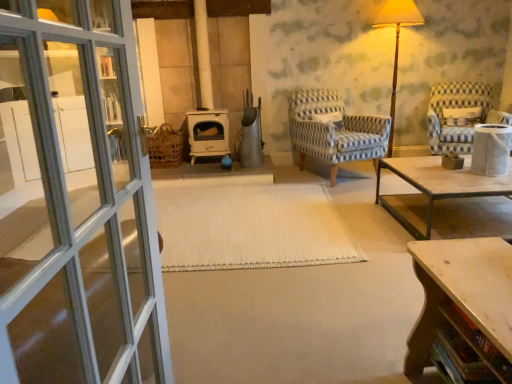
What do you see at coordinates (250, 227) in the screenshot? The height and width of the screenshot is (384, 512). I see `white textured mat at center` at bounding box center [250, 227].

Where is `wooden side table at right`? This screenshot has width=512, height=384. wooden side table at right is located at coordinates (490, 149).

At what (x,y) coordinates should I click in order to perform the action: click on white textured mat at center. Please return your answer as a coordinate pair (x, y). This screenshot has width=512, height=384. Looking at the image, I should click on (250, 227).

How distant is white textured mat at center from blue-patterned fabric chair at center, the 1th chair when ordered from left to right?

white textured mat at center is 3.74 feet away from blue-patterned fabric chair at center, the 1th chair when ordered from left to right.

Looking at their sizes, would you say white textured mat at center is wider or thinner than blue-patterned fabric chair at center, the 1th chair when ordered from left to right?

In the image, white textured mat at center appears to be wider than blue-patterned fabric chair at center, the 1th chair when ordered from left to right.

In order to click on the 1st chair behind the white textured mat at center, starting your count from the anchor in this screenshot , I will do `click(334, 131)`.

From the image's perspective, between white textured mat at center and blue-patterned fabric chair at center, placed as the second chair when sorted from right to left, which one is located above?

blue-patterned fabric chair at center, placed as the second chair when sorted from right to left, appears higher in the image.

Which is behind, wooden side table at right or wooden floor lamp at upper right?

wooden floor lamp at upper right is further from the camera.

Is wooden side table at right inside the boundaries of wooden floor lamp at upper right, or outside?

wooden side table at right exists outside the volume of wooden floor lamp at upper right.

Is point (501, 164) positioned in front of point (379, 20)?

Yes, point (501, 164) is in front of point (379, 20).

Is wooden side table at right positioned far away from wooden floor lamp at upper right?

Yes.

Looking at the image, does wooden floor lamp at upper right seem bigger or smaller compared to blue and white patterned fabric armchair at right, which is the second chair in left-to-right order?

Clearly, wooden floor lamp at upper right is smaller in size than blue and white patterned fabric armchair at right, which is the second chair in left-to-right order.

Consider the image. Does wooden floor lamp at upper right come behind blue and white patterned fabric armchair at right, which is counted as the first chair, starting from the right?

Yes, wooden floor lamp at upper right is behind blue and white patterned fabric armchair at right, which is counted as the first chair, starting from the right.

Can you confirm if wooden floor lamp at upper right is thinner than blue and white patterned fabric armchair at right, which is counted as the first chair, starting from the right?

Indeed, wooden floor lamp at upper right has a lesser width compared to blue and white patterned fabric armchair at right, which is counted as the first chair, starting from the right.

Considering the positions of points (417, 17) and (459, 85), is point (417, 17) closer to camera compared to point (459, 85)?

Yes, point (417, 17) is closer to viewer.

Is white textured mat at center touching blue and white patterned fabric armchair at right, which is the second chair in left-to-right order?

white textured mat at center and blue and white patterned fabric armchair at right, which is the second chair in left-to-right order, are not in contact.

From a real-world perspective, is white textured mat at center over blue and white patterned fabric armchair at right, which is the second chair in left-to-right order?

No, from a real-world perspective, white textured mat at center is not over blue and white patterned fabric armchair at right, which is the second chair in left-to-right order

From the image's perspective, between white textured mat at center and blue and white patterned fabric armchair at right, which is the second chair in left-to-right order, who is located below?

white textured mat at center, from the image's perspective.

Relative to blue and white patterned fabric armchair at right, which is counted as the first chair, starting from the right, is white textured mat at center in front or behind?

Clearly, white textured mat at center is in front of blue and white patterned fabric armchair at right, which is counted as the first chair, starting from the right.

Consider the image. Does wooden side table at right have a greater height compared to wooden table at lower right?

No, wooden side table at right is not taller than wooden table at lower right.

Does wooden side table at right have a lesser width compared to wooden table at lower right?

Correct, the width of wooden side table at right is less than that of wooden table at lower right.

At what (x,y) coordinates should I click in order to perform the action: click on table located in front of the wooden side table at right. Please return your answer as a coordinate pair (x, y). This screenshot has height=384, width=512. Looking at the image, I should click on (463, 309).

Could you tell me if wooden side table at right is turned towards wooden table at lower right?

No, wooden side table at right is not aimed at wooden table at lower right.

Is white textured mat at center surrounding wooden floor lamp at upper right?

No, white textured mat at center does not contain wooden floor lamp at upper right.

Considering the positions of point (219, 230) and point (412, 0), is point (219, 230) closer or farther from the camera than point (412, 0)?

Point (219, 230) is positioned closer to the camera compared to point (412, 0).

Who is shorter, white textured mat at center or wooden floor lamp at upper right?

white textured mat at center is shorter.

How many degrees apart are the facing directions of white textured mat at center and wooden floor lamp at upper right?

They differ by 89.3 degrees in their facing directions.

How different are the orientations of wooden table at lower right and wooden floor lamp at upper right in degrees?

wooden table at lower right and wooden floor lamp at upper right are facing 89.5 degrees away from each other.

From a real-world perspective, who is located lower, wooden table at lower right or wooden floor lamp at upper right?

In real-world perspective, wooden table at lower right is lower.

Does wooden table at lower right have a smaller size compared to wooden floor lamp at upper right?

Correct, wooden table at lower right occupies less space than wooden floor lamp at upper right.

Is wooden table at lower right far from wooden floor lamp at upper right?

Indeed, wooden table at lower right is not near wooden floor lamp at upper right.

You are a GUI agent. You are given a task and a screenshot of the screen. Output one action in this format:
    pyautogui.click(x=<x>, y=<y>)
    Task: Click on the mat in front of the blue-patterned fabric chair at center, placed as the second chair when sorted from right to left
    Image resolution: width=512 pixels, height=384 pixels.
    Given the screenshot: What is the action you would take?
    point(250,227)

Find the location of a particular element. This screenshot has width=512, height=384. table lamp on the left of wooden side table at right is located at coordinates (396, 42).

Looking at the image, which one is located further to blue-patterned fabric chair at center, placed as the second chair when sorted from right to left, wooden side table at right or white textured mat at center?

Based on the image, wooden side table at right appears to be further to blue-patterned fabric chair at center, placed as the second chair when sorted from right to left.

Considering their positions, is blue and white patterned fabric armchair at right, which is counted as the first chair, starting from the right, positioned further to wooden table at lower right than blue-patterned fabric chair at center, placed as the second chair when sorted from right to left?

Based on the image, blue-patterned fabric chair at center, placed as the second chair when sorted from right to left, appears to be further to wooden table at lower right.

Based on their spatial positions, is wooden floor lamp at upper right or wooden side table at right further from blue-patterned fabric chair at center, the 1th chair when ordered from left to right?

wooden side table at right is positioned further to the anchor blue-patterned fabric chair at center, the 1th chair when ordered from left to right.

Considering their positions, is blue-patterned fabric chair at center, placed as the second chair when sorted from right to left, positioned further to wooden table at lower right than blue and white patterned fabric armchair at right, which is counted as the first chair, starting from the right?

The object further to wooden table at lower right is blue-patterned fabric chair at center, placed as the second chair when sorted from right to left.

Which object lies further to the anchor point blue-patterned fabric chair at center, placed as the second chair when sorted from right to left, wooden table at lower right or wooden side table at right?

Among the two, wooden table at lower right is located further to blue-patterned fabric chair at center, placed as the second chair when sorted from right to left.

In the scene shown: From the image, which object appears to be farther from blue and white patterned fabric armchair at right, which is the second chair in left-to-right order, wooden table at lower right or blue-patterned fabric chair at center, placed as the second chair when sorted from right to left?

Based on the image, wooden table at lower right appears to be further to blue and white patterned fabric armchair at right, which is the second chair in left-to-right order.

From the picture: Based on their spatial positions, is white textured mat at center or blue and white patterned fabric armchair at right, which is the second chair in left-to-right order, further from wooden floor lamp at upper right?

white textured mat at center.

Based on their spatial positions, is blue-patterned fabric chair at center, the 1th chair when ordered from left to right, or blue and white patterned fabric armchair at right, which is counted as the first chair, starting from the right, further from wooden floor lamp at upper right?

blue-patterned fabric chair at center, the 1th chair when ordered from left to right, lies further to wooden floor lamp at upper right than the other object.

Image resolution: width=512 pixels, height=384 pixels. What are the coordinates of `side table positioned between wooden table at lower right and blue-patterned fabric chair at center, the 1th chair when ordered from left to right, from near to far` in the screenshot? It's located at (490, 149).

The height and width of the screenshot is (384, 512). What are the coordinates of `chair between white textured mat at center and wooden floor lamp at upper right` in the screenshot? It's located at 334,131.

Find the location of `side table between wooden table at lower right and blue and white patterned fabric armchair at right, which is counted as the first chair, starting from the right, from front to back`. side table between wooden table at lower right and blue and white patterned fabric armchair at right, which is counted as the first chair, starting from the right, from front to back is located at coordinates (490, 149).

Where is `chair between wooden table at lower right and blue and white patterned fabric armchair at right, which is counted as the first chair, starting from the right, along the z-axis`? This screenshot has width=512, height=384. chair between wooden table at lower right and blue and white patterned fabric armchair at right, which is counted as the first chair, starting from the right, along the z-axis is located at coordinates (334, 131).